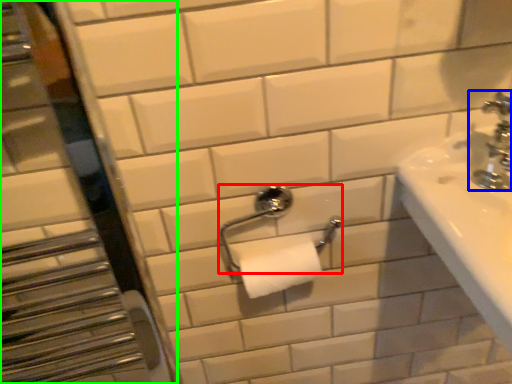
Question: Based on their relative distances, which object is farther from towel bar (highlighted by a red box)? Choose from tap (highlighted by a blue box) and mirror (highlighted by a green box).

Choices:
 (A) tap
 (B) mirror

Answer: (B)